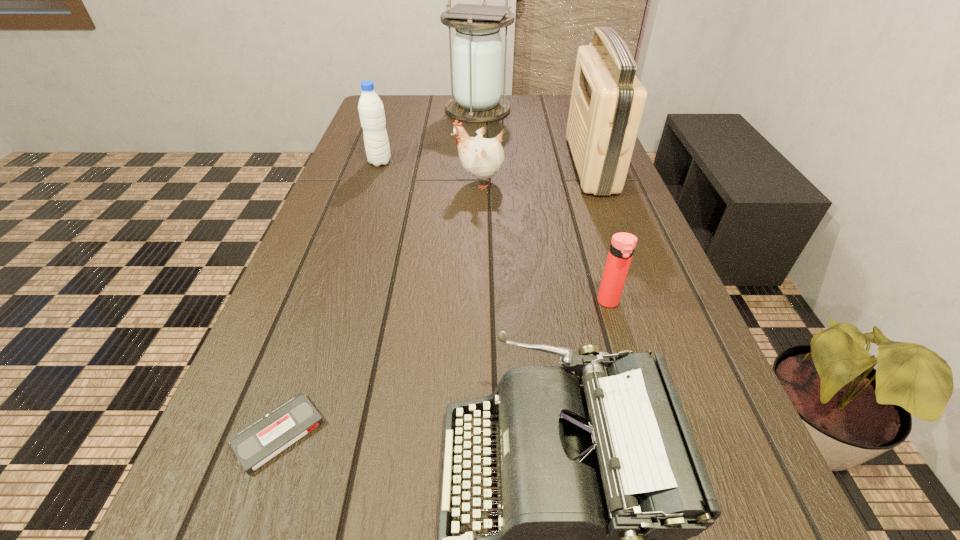
Find the location of a particular element. object that is the closest to the thermos bottle is located at coordinates (600, 484).

Identify the location of vacant space that satisfies the following two spatial constraints: 1. at the beak of the thermos bottle; 2. on the right side of the bird. This screenshot has width=960, height=540. (480, 302).